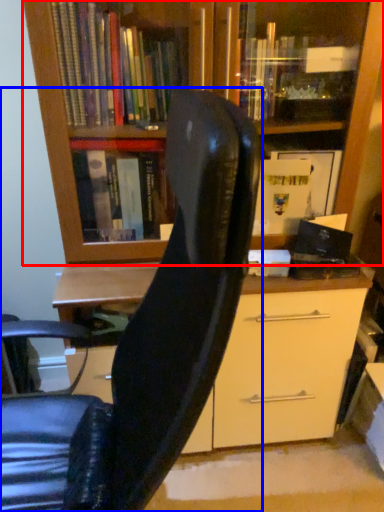
Question: Which object appears farthest to the camera in this image, bookcase (highlighted by a red box) or chair (highlighted by a blue box)?

Choices:
 (A) bookcase
 (B) chair

Answer: (A)